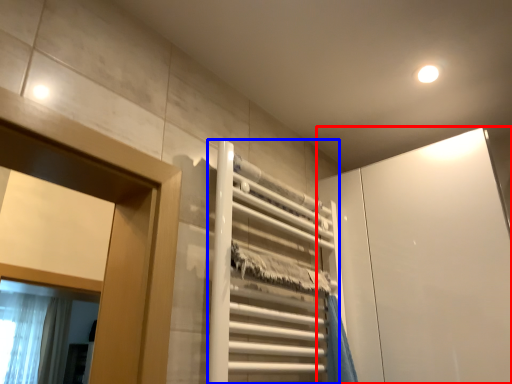
Question: Which of the following is the closest to the observer, screen door (highlighted by a red box) or elevator (highlighted by a blue box)?

Choices:
 (A) screen door
 (B) elevator

Answer: (B)